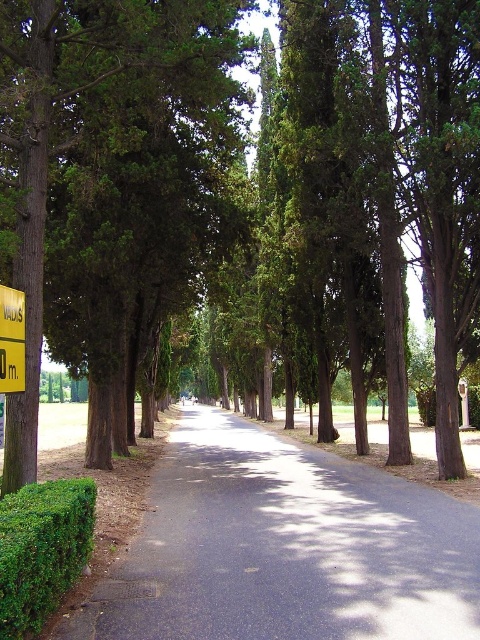
Can you confirm if dark asphalt road at center is wider than yellow plastic sign at left?

Yes.

Does point (295, 589) lie behind point (6, 388)?

That is False.

Is point (211, 577) more distant than point (12, 307)?

No, it is not.

The height and width of the screenshot is (640, 480). Find the location of `dark asphalt road at center`. dark asphalt road at center is located at coordinates (285, 547).

Is point (308, 472) in front of point (57, 577)?

No, (308, 472) is behind (57, 577).

Which is in front, point (367, 547) or point (39, 576)?

Point (39, 576) is in front.

Does point (300, 460) come closer to viewer compared to point (48, 536)?

That is False.

At what (x,y) coordinates should I click in order to perform the action: click on dark asphalt road at center. Please return your answer as a coordinate pair (x, y). This screenshot has height=640, width=480. Looking at the image, I should click on coord(285,547).

What do you see at coordinates (41, 548) in the screenshot? The image size is (480, 640). I see `green leafy hedge at lower left` at bounding box center [41, 548].

Does green leafy hedge at lower left have a lesser width compared to yellow plastic sign at left?

No.

Which is behind, point (82, 506) or point (22, 330)?

The point (22, 330) is more distant.

Identify the location of green leafy hedge at lower left. (41, 548).